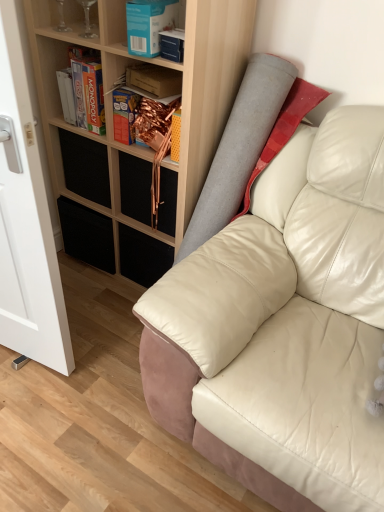
Question: Is metallic gold drawer at center, which is the 2th drawer from left to right, outside of blue cardboard box at upper center, which is the 1th book from front to back?

Choices:
 (A) no
 (B) yes

Answer: (B)

Question: Can you confirm if metallic gold drawer at center, which is the 2th drawer from left to right, is positioned to the left of blue cardboard box at upper center, the 2th book from the back?

Choices:
 (A) yes
 (B) no

Answer: (A)

Question: From the image's perspective, is metallic gold drawer at center, which is the 2th drawer from left to right, above blue cardboard box at upper center, the 2th book from the back?

Choices:
 (A) yes
 (B) no

Answer: (B)

Question: Is blue cardboard box at upper center, which is the 1th book from front to back, at the back of metallic gold drawer at center, which is the 2th drawer from left to right?

Choices:
 (A) no
 (B) yes

Answer: (A)

Question: Considering the relative positions of metallic gold drawer at center, positioned as the first drawer in right-to-left order, and blue cardboard box at upper center, the 2th book from the back, in the image provided, is metallic gold drawer at center, positioned as the first drawer in right-to-left order, in front of blue cardboard box at upper center, the 2th book from the back,?

Choices:
 (A) yes
 (B) no

Answer: (B)

Question: Are metallic gold drawer at center, which is the 2th drawer from left to right, and blue cardboard box at upper center, the 2th book from the back, making contact?

Choices:
 (A) no
 (B) yes

Answer: (A)

Question: Is white glossy glass door at left outside transparent glass wine glasses at upper left, arranged as the 1th shelf when viewed from the top?

Choices:
 (A) yes
 (B) no

Answer: (A)

Question: Is white glossy glass door at left to the right of transparent glass wine glasses at upper left, which is the 2th shelf in bottom-to-top order, from the viewer's perspective?

Choices:
 (A) no
 (B) yes

Answer: (A)

Question: Can you confirm if white glossy glass door at left is shorter than transparent glass wine glasses at upper left, arranged as the 1th shelf when viewed from the top?

Choices:
 (A) no
 (B) yes

Answer: (A)

Question: From the image's perspective, is white glossy glass door at left below transparent glass wine glasses at upper left, which is the first shelf in back-to-front order?

Choices:
 (A) no
 (B) yes

Answer: (B)

Question: Is white glossy glass door at left looking in the opposite direction of transparent glass wine glasses at upper left, which is the 2th shelf in bottom-to-top order?

Choices:
 (A) yes
 (B) no

Answer: (A)

Question: From a real-world perspective, is white glossy glass door at left located beneath transparent glass wine glasses at upper left, arranged as the 1th shelf when viewed from the top?

Choices:
 (A) no
 (B) yes

Answer: (B)

Question: Is white glossy glass door at left oriented away from blue cardboard box at upper center, which is the 1th book from front to back?

Choices:
 (A) yes
 (B) no

Answer: (A)